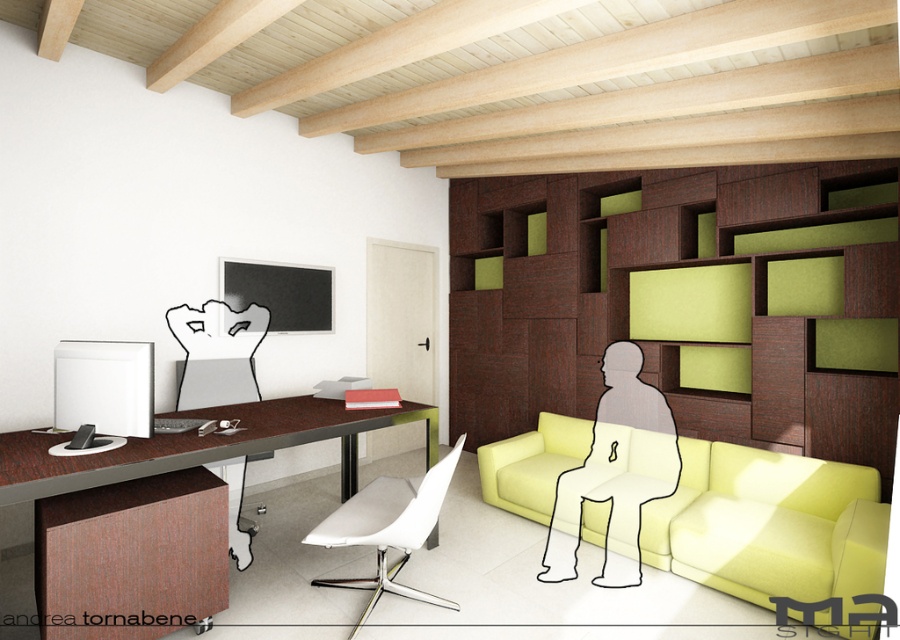
Question: Does matte yellow couch at center appear on the right side of white matte chair at center?

Choices:
 (A) no
 (B) yes

Answer: (B)

Question: Can you confirm if brown wood desk at left is bigger than white matte chair at center?

Choices:
 (A) no
 (B) yes

Answer: (B)

Question: Among these objects, which one is farthest from the camera?

Choices:
 (A) matte yellow couch at center
 (B) white matte chair at center

Answer: (B)

Question: Is matte yellow couch at center in front of white matte chair at center?

Choices:
 (A) yes
 (B) no

Answer: (A)

Question: Which is farther from the brown wood desk at left?

Choices:
 (A) matte yellow couch at center
 (B) white matte chair at center

Answer: (A)

Question: Which of the following is the closest to the observer?

Choices:
 (A) (826, 548)
 (B) (72, 477)

Answer: (B)